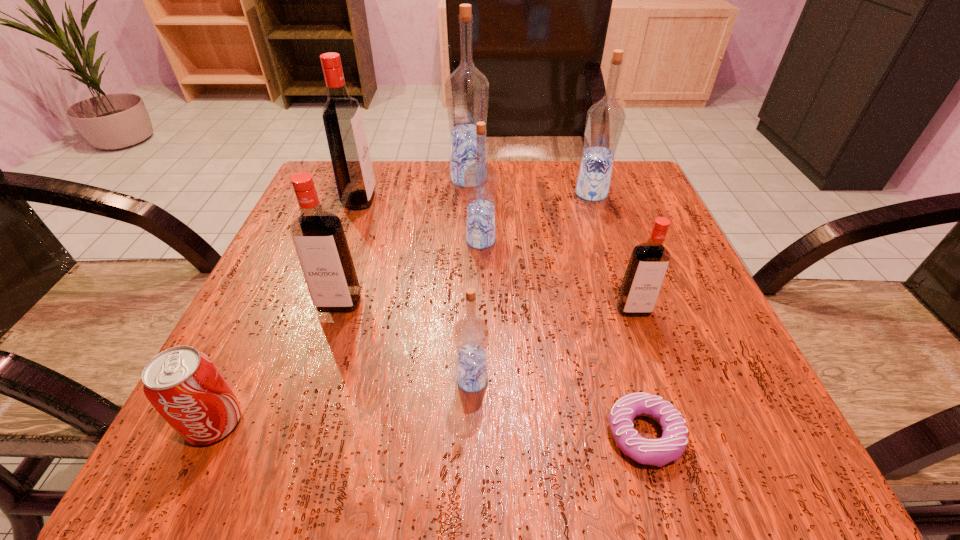
You are a GUI agent. You are given a task and a screenshot of the screen. Output one action in this format:
    pyautogui.click(x=<x>, y=<y>)
    Task: Click on the second shortest object
    This screenshot has width=960, height=540.
    Given the screenshot: What is the action you would take?
    pyautogui.click(x=184, y=385)

At what (x,y) coordinates should I click in order to perform the action: click on soda. Please return your answer as a coordinate pair (x, y). This screenshot has width=960, height=540. Looking at the image, I should click on (184, 385).

Find the location of a particular element. This screenshot has width=960, height=540. the shortest object is located at coordinates (658, 452).

Where is `purple doughnut`? The height and width of the screenshot is (540, 960). purple doughnut is located at coordinates (658, 452).

Image resolution: width=960 pixels, height=540 pixels. Identify the location of vacant region located 0.290m on the front of the biggest blue vodka. (466, 276).

What are the coordinates of `vacant position located on the front of the second biggest blue vodka` in the screenshot? It's located at (644, 349).

At what (x,y) coordinates should I click in order to perform the action: click on blank area located 0.220m on the front and back of the biggest red vodka. Please return your answer as a coordinate pair (x, y). The width and height of the screenshot is (960, 540). Looking at the image, I should click on (474, 200).

Locate an element on the screen. free location located on the left of the fourth farthest object is located at coordinates (384, 241).

Locate an element on the screen. vacant space located 0.150m on the front and back of the second biggest red vodka is located at coordinates (310, 395).

This screenshot has height=540, width=960. In order to click on blank space located on the front and back of the rightmost red vodka in this screenshot , I will do `click(669, 413)`.